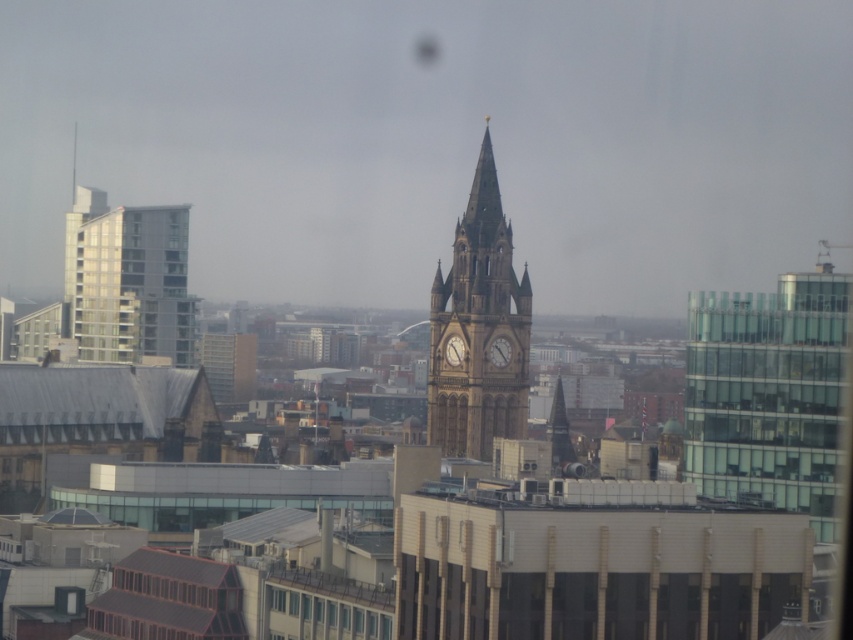
Question: Based on their relative distances, which object is farther from the matte brown clock at center?

Choices:
 (A) clear glass windows at center
 (B) brown stone clock tower at center
 (C) golden stone clock at center

Answer: (A)

Question: Considering the real-world distances, which object is farthest from the clear glass windows at center?

Choices:
 (A) golden stone spire at upper center
 (B) brown stone clock tower at center

Answer: (A)

Question: Which of the following is the farthest from the observer?

Choices:
 (A) golden stone spire at upper center
 (B) golden stone clock at center
 (C) brown stone clock tower at center

Answer: (A)

Question: Does clear glass windows at center have a lesser width compared to matte brown clock at center?

Choices:
 (A) no
 (B) yes

Answer: (A)

Question: Considering the relative positions of clear glass windows at center and golden stone clock at center in the image provided, where is clear glass windows at center located with respect to golden stone clock at center?

Choices:
 (A) below
 (B) above

Answer: (A)

Question: Does golden stone clock at center appear on the right side of matte brown clock at center?

Choices:
 (A) yes
 (B) no

Answer: (A)